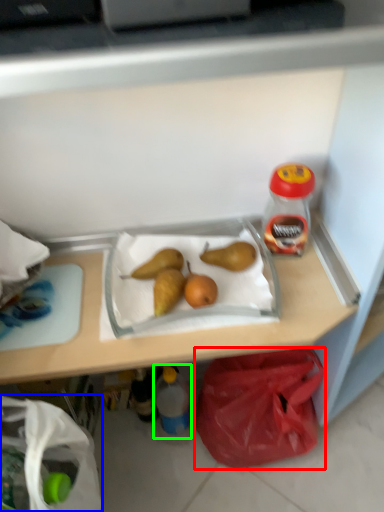
Question: Which is farther away from plastic bag (highlighted by a red box)? grocery bag (highlighted by a blue box) or bottle (highlighted by a green box)?

Choices:
 (A) grocery bag
 (B) bottle

Answer: (A)